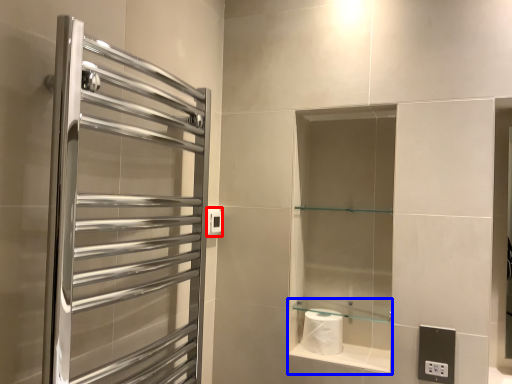
Question: Which object is closer to the camera taking this photo, electric outlet (highlighted by a red box) or cabinet (highlighted by a blue box)?

Choices:
 (A) electric outlet
 (B) cabinet

Answer: (B)